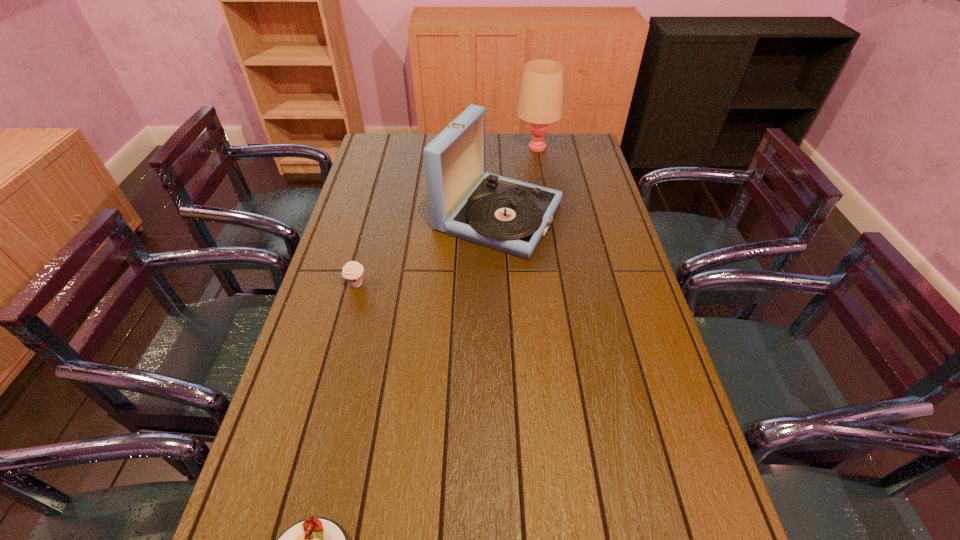
Where is `object located in the far right corner section of the desktop`? object located in the far right corner section of the desktop is located at coordinates (540, 102).

In the image, there is a desktop. Identify the location of blank space at the far edge. (516, 134).

Where is `vacant area at the left edge of the desktop`? vacant area at the left edge of the desktop is located at coordinates (343, 236).

This screenshot has width=960, height=540. Find the location of `free point at the right edge`. free point at the right edge is located at coordinates (646, 404).

Image resolution: width=960 pixels, height=540 pixels. In the image, there is a desktop. Identify the location of vacant space at the far left corner. (385, 154).

Where is `free space between the second farthest object and the second nearest object`? free space between the second farthest object and the second nearest object is located at coordinates (427, 250).

Identify the location of empty location between the phonograph record and the second nearest object. This screenshot has width=960, height=540. (427, 250).

In order to click on free spot between the third nearest object and the muffin in this screenshot , I will do 427,250.

Locate an element on the screen. The width and height of the screenshot is (960, 540). free space between the phonograph record and the muffin is located at coordinates (427, 250).

Locate an element on the screen. The width and height of the screenshot is (960, 540). the closest object to the nearest object is located at coordinates [353, 272].